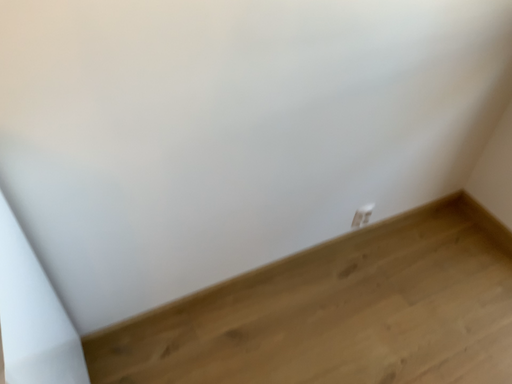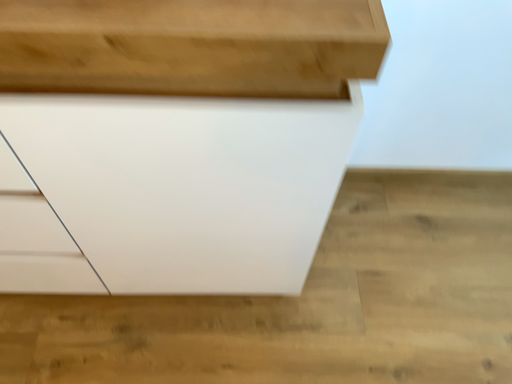
Question: Which way did the camera rotate in the video?

Choices:
 (A) rotated downward
 (B) rotated upward

Answer: (A)